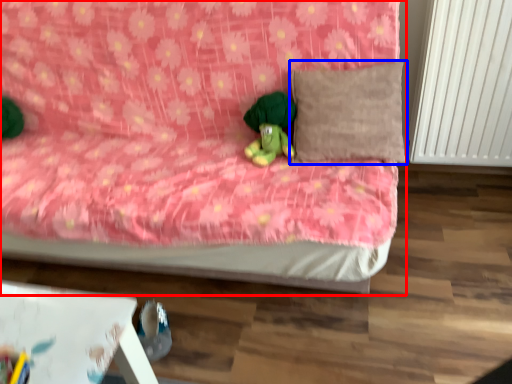
Question: Which of the following is the closest to the observer, bed (highlighted by a red box) or pillow (highlighted by a blue box)?

Choices:
 (A) bed
 (B) pillow

Answer: (A)